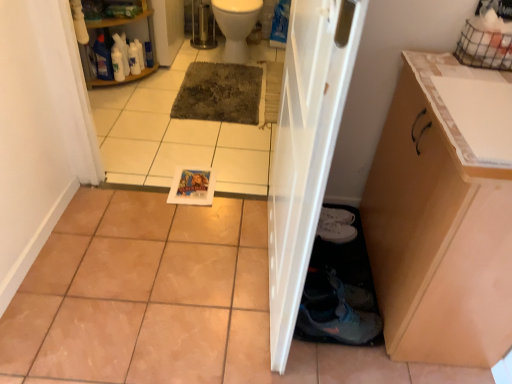
Question: Is gray textured mat at center next to white plastic shelf at upper left?

Choices:
 (A) yes
 (B) no

Answer: (B)

Question: Can you confirm if gray textured mat at center is wider than white plastic shelf at upper left?

Choices:
 (A) no
 (B) yes

Answer: (B)

Question: Is gray textured mat at center oriented towards white plastic shelf at upper left?

Choices:
 (A) yes
 (B) no

Answer: (B)

Question: Does gray textured mat at center appear on the right side of white plastic shelf at upper left?

Choices:
 (A) no
 (B) yes

Answer: (B)

Question: Is white plastic shelf at upper left completely or partially inside gray textured mat at center?

Choices:
 (A) no
 (B) yes

Answer: (A)

Question: From the image's perspective, is white tile at lower center above or below white glossy toilet bowl at upper center?

Choices:
 (A) below
 (B) above

Answer: (A)

Question: Is white tile at lower center inside the boundaries of white glossy toilet bowl at upper center, or outside?

Choices:
 (A) inside
 (B) outside

Answer: (B)

Question: From a real-world perspective, is white tile at lower center positioned above or below white glossy toilet bowl at upper center?

Choices:
 (A) above
 (B) below

Answer: (A)

Question: In the image, is white tile at lower center positioned in front of or behind white glossy toilet bowl at upper center?

Choices:
 (A) behind
 (B) front

Answer: (B)

Question: Is white plastic shelf at upper left wider or thinner than gray textured mat at center?

Choices:
 (A) thin
 (B) wide

Answer: (A)

Question: From the image's perspective, is white plastic shelf at upper left positioned above or below gray textured mat at center?

Choices:
 (A) below
 (B) above

Answer: (B)

Question: Is white plastic shelf at upper left situated inside gray textured mat at center or outside?

Choices:
 (A) outside
 (B) inside

Answer: (A)

Question: Considering the positions of point click(x=113, y=19) and point click(x=228, y=109), is point click(x=113, y=19) closer or farther from the camera than point click(x=228, y=109)?

Choices:
 (A) closer
 (B) farther

Answer: (B)

Question: Is white glossy toilet bowl at upper center to the left or to the right of gray textured mat at center in the image?

Choices:
 (A) right
 (B) left

Answer: (A)

Question: Is white glossy toilet bowl at upper center situated inside gray textured mat at center or outside?

Choices:
 (A) inside
 (B) outside

Answer: (B)